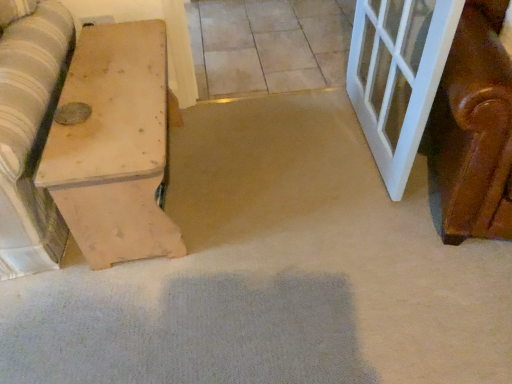
At what (x,y) coordinates should I click in order to perform the action: click on neutral stone tile at center. Please return your answer as a coordinate pair (x, y). The width and height of the screenshot is (512, 384). Looking at the image, I should click on (267, 45).

What do you see at coordinates (267, 45) in the screenshot?
I see `neutral stone tile at center` at bounding box center [267, 45].

Identify the location of light brown wood chest at left. (114, 146).

Image resolution: width=512 pixels, height=384 pixels. What do you see at coordinates (114, 146) in the screenshot?
I see `light brown wood chest at left` at bounding box center [114, 146].

Locate an element on the screen. neutral stone tile at center is located at coordinates (267, 45).

Which object is positioned more to the right, light brown wood chest at left or neutral stone tile at center?

From the viewer's perspective, neutral stone tile at center appears more on the right side.

Is the depth of light brown wood chest at left greater than that of neutral stone tile at center?

No, it is not.

Does point (112, 202) come farther from viewer compared to point (329, 66)?

No, it is not.

From the image's perspective, would you say light brown wood chest at left is positioned over neutral stone tile at center?

Actually, light brown wood chest at left appears below neutral stone tile at center in the image.

From a real-world perspective, which is physically above, light brown wood chest at left or neutral stone tile at center?

light brown wood chest at left.

Considering the sizes of objects light brown wood chest at left and neutral stone tile at center in the image provided, who is wider, light brown wood chest at left or neutral stone tile at center?

Wider between the two is neutral stone tile at center.

Does light brown wood chest at left have a greater height compared to neutral stone tile at center?

Correct, light brown wood chest at left is much taller as neutral stone tile at center.

Can you confirm if light brown wood chest at left is bigger than neutral stone tile at center?

Yes.

Is neutral stone tile at center completely or partially inside light brown wood chest at left?

Definitely not — neutral stone tile at center is not inside light brown wood chest at left.

Is light brown wood chest at left with neutral stone tile at center?

light brown wood chest at left and neutral stone tile at center are clearly separated.

In the scene shown: Is light brown wood chest at left turned away from neutral stone tile at center?

No, light brown wood chest at left is not facing the opposite direction of neutral stone tile at center.

I want to click on tile on the right of light brown wood chest at left, so (x=267, y=45).

Visually, is neutral stone tile at center positioned to the left or to the right of light brown wood chest at left?

From the image, it's evident that neutral stone tile at center is to the right of light brown wood chest at left.

Is the depth of neutral stone tile at center less than that of light brown wood chest at left?

No, the depth of neutral stone tile at center is greater than that of light brown wood chest at left.

Which is closer, (338, 21) or (135, 141)?

Point (338, 21) appears to be farther away from the viewer than point (135, 141).

From the image's perspective, is neutral stone tile at center above or below light brown wood chest at left?

Based on their image positions, neutral stone tile at center is located above light brown wood chest at left.

From a real-world perspective, who is located higher, neutral stone tile at center or light brown wood chest at left?

light brown wood chest at left is physically above.

Which of these two, neutral stone tile at center or light brown wood chest at left, is thinner?

Thinner between the two is light brown wood chest at left.

Does neutral stone tile at center have a greater height compared to light brown wood chest at left?

In fact, neutral stone tile at center may be shorter than light brown wood chest at left.

Does neutral stone tile at center have a smaller size compared to light brown wood chest at left?

Correct, neutral stone tile at center occupies less space than light brown wood chest at left.

Is neutral stone tile at center not within light brown wood chest at left?

Yes.

Are neutral stone tile at center and light brown wood chest at left making contact?

They are not placed beside each other.

Is neutral stone tile at center turned away from light brown wood chest at left?

No, neutral stone tile at center is not facing the opposite direction of light brown wood chest at left.

How different are the orientations of neutral stone tile at center and light brown wood chest at left in degrees?

They differ by 89.6 degrees in their facing directions.

This screenshot has height=384, width=512. Identify the location of furniture below the neutral stone tile at center (from the image's perspective). (114, 146).

At what (x,y) coordinates should I click in order to perform the action: click on tile on the right of the light brown wood chest at left. Please return your answer as a coordinate pair (x, y). The height and width of the screenshot is (384, 512). Looking at the image, I should click on (267, 45).

Locate an element on the screen. furniture on the left of neutral stone tile at center is located at coordinates (114, 146).